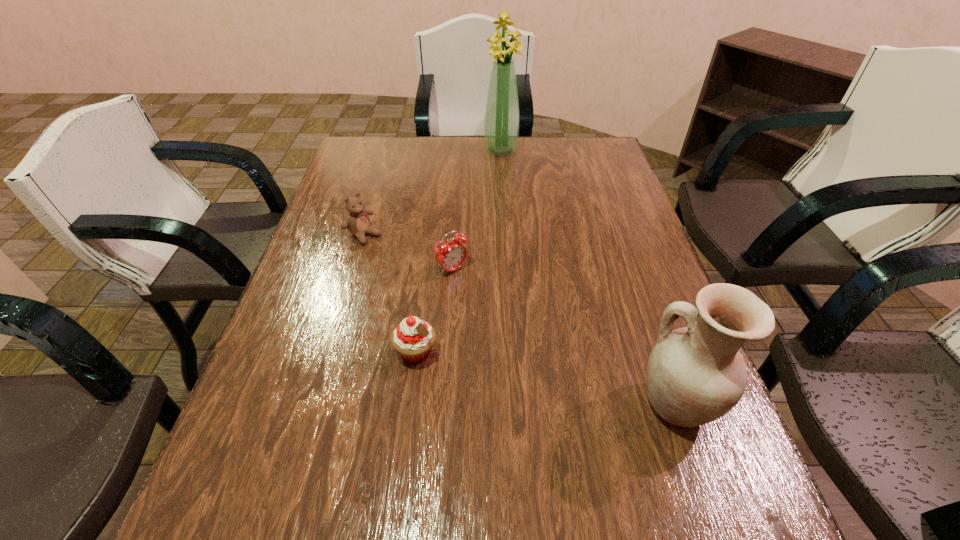
Image resolution: width=960 pixels, height=540 pixels. What are the coordinates of `vacant point located between the rightmost object and the alarm clock` in the screenshot? It's located at (564, 337).

What are the coordinates of `vacant space that is in between the rightmost object and the alarm clock` in the screenshot? It's located at (564, 337).

Locate an element on the screen. empty space that is in between the alarm clock and the second farthest object is located at coordinates (408, 252).

In order to click on vacant space in between the second tallest object and the tallest object in this screenshot , I will do `click(588, 277)`.

Image resolution: width=960 pixels, height=540 pixels. What are the coordinates of `free point between the third nearest object and the cupcake` in the screenshot? It's located at (434, 311).

You are a GUI agent. You are given a task and a screenshot of the screen. Output one action in this format:
    pyautogui.click(x=<x>, y=<y>)
    Task: Click on the free space between the teddy bear and the cupcake
    This screenshot has height=540, width=960.
    Given the screenshot: What is the action you would take?
    pyautogui.click(x=390, y=293)

The image size is (960, 540). Identify the location of blank region between the pottery and the tallest object. (588, 277).

I want to click on free space between the teddy bear and the alarm clock, so click(x=408, y=252).

Find the location of a particular element. The width and height of the screenshot is (960, 540). the closest object to the alarm clock is located at coordinates (358, 222).

Select which object appears as the fourth closest to the leftmost object. Please provide its 2D coordinates. Your answer should be formatted as a tuple, i.e. [(x, y)], where the tuple contains the x and y coordinates of a point satisfying the conditions above.

[(695, 374)]